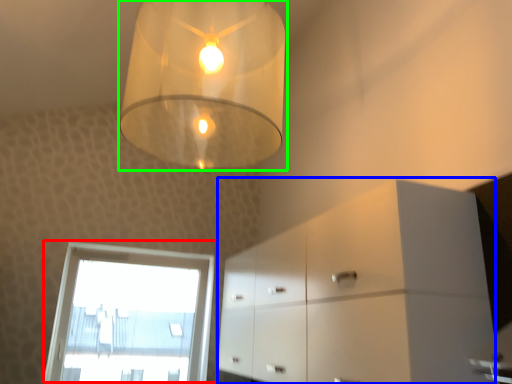
Question: Based on their relative distances, which object is farther from window (highlighted by a red box)? Choose from dresser (highlighted by a blue box) and lamp (highlighted by a green box).

Choices:
 (A) dresser
 (B) lamp

Answer: (B)